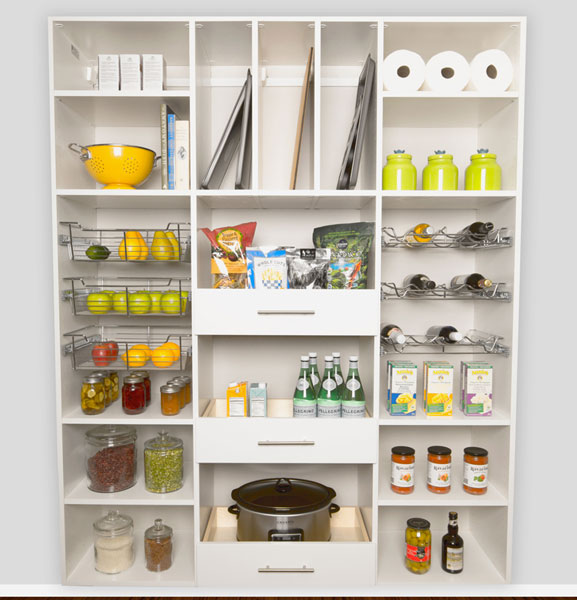
Locate an element on the screen. This screenshot has height=600, width=577. divider for shelves going up and down is located at coordinates (193, 117), (252, 129), (316, 141), (380, 153).